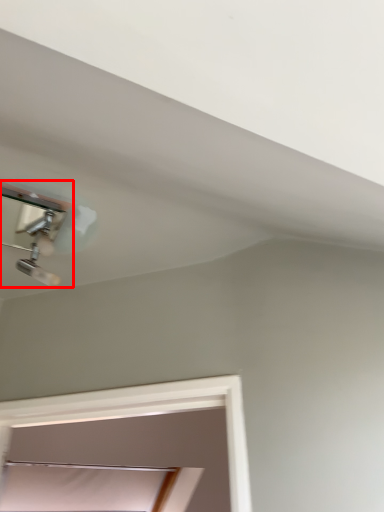
Question: From the image's perspective, where is lamp (annotated by the red box) located relative to window?

Choices:
 (A) below
 (B) above

Answer: (B)